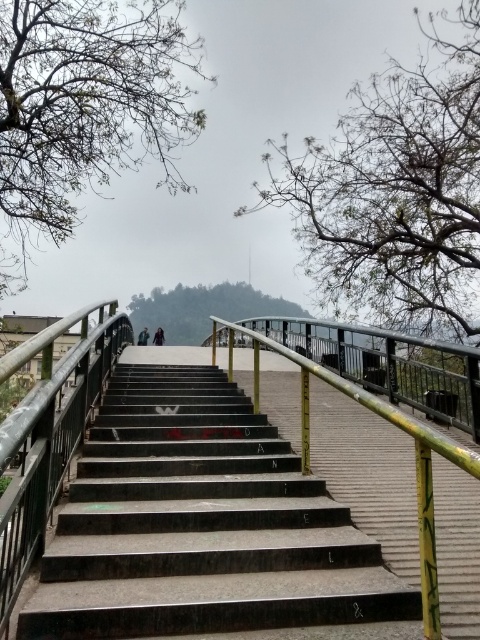
Question: Which of the following is the closest to the observer?

Choices:
 (A) (162, 336)
 (B) (143, 328)
 (C) (411, 282)

Answer: (C)

Question: Is black polished stairs at center to the right of dark brown leather jacket at center from the viewer's perspective?

Choices:
 (A) yes
 (B) no

Answer: (A)

Question: Does black polished stairs at center lie in front of green leafy tree at center?

Choices:
 (A) no
 (B) yes

Answer: (B)

Question: Is bare branches at upper center in front of green leafy tree at center?

Choices:
 (A) yes
 (B) no

Answer: (A)

Question: Which of the following is the farthest from the observer?

Choices:
 (A) (163, 333)
 (B) (142, 317)
 (C) (21, 172)
 (D) (142, 333)

Answer: (D)

Question: Which point is closer to the camera taking this photo?

Choices:
 (A) (248, 596)
 (B) (316, 147)
 (C) (282, 312)
 (D) (169, 4)

Answer: (A)